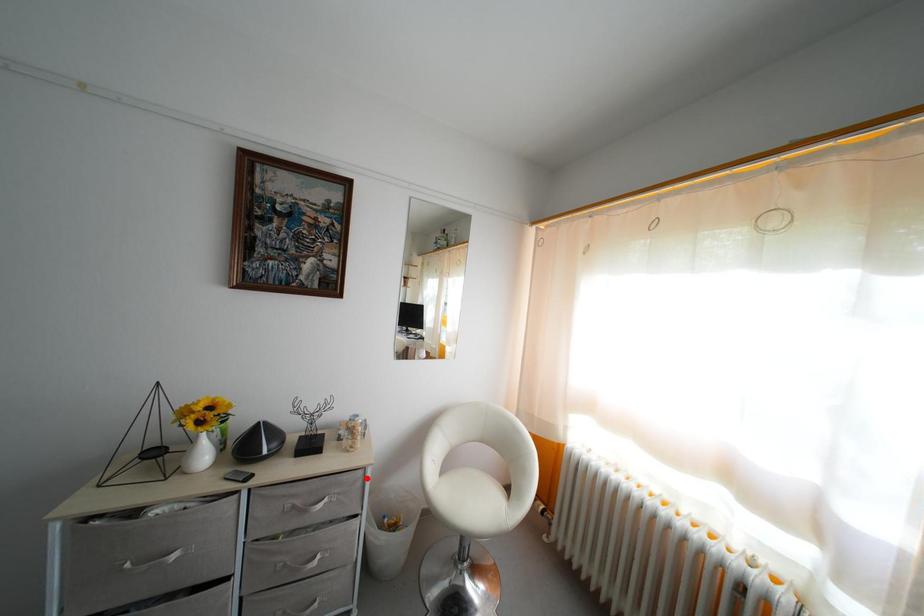
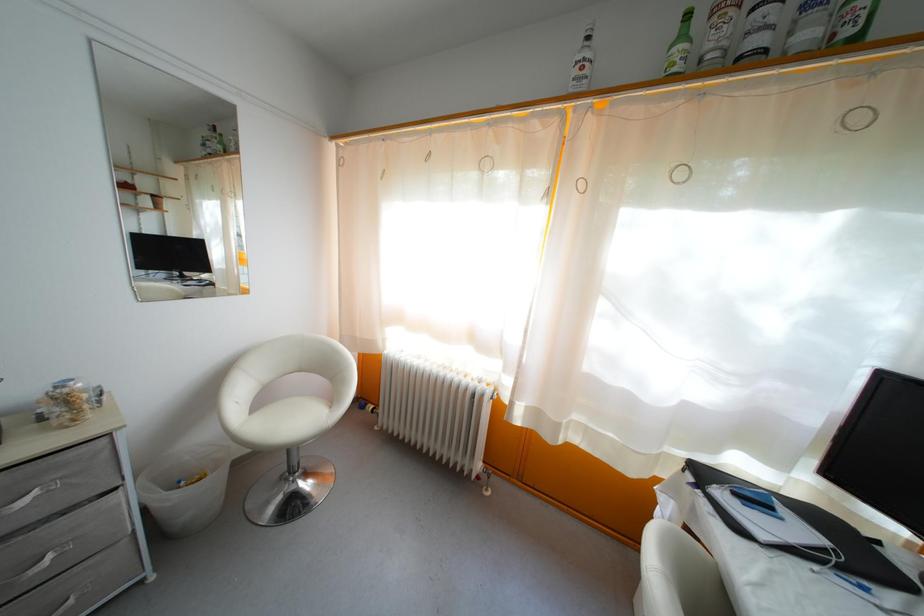
The point at the highlighted location is marked in the first image. Where is the corresponding point in the second image?

(110, 447)